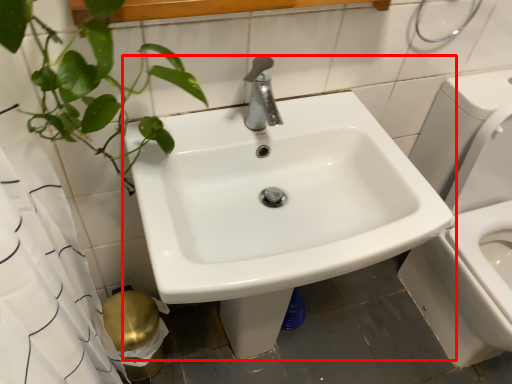
Question: Where is sink (annotated by the red box) located in relation to toilet paper in the image?

Choices:
 (A) left
 (B) right

Answer: (B)